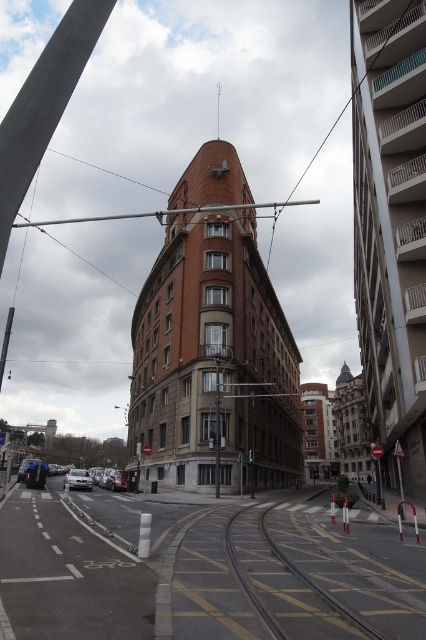
How much distance is there between silver metallic sedan at lower left and silver metallic car at lower left?

silver metallic sedan at lower left is 12.40 meters away from silver metallic car at lower left.

Which is behind, point (75, 470) or point (124, 484)?

The point (75, 470) is behind.

Where is `silver metallic sedan at lower left`? The width and height of the screenshot is (426, 640). silver metallic sedan at lower left is located at coordinates (77, 480).

Can you confirm if yellow textured train track at center is positioned above silver metallic car at lower left?

Yes, yellow textured train track at center is above silver metallic car at lower left.

Which is behind, point (359, 620) or point (112, 468)?

Positioned behind is point (112, 468).

The width and height of the screenshot is (426, 640). Identify the location of yellow textured train track at center. (310, 579).

Is yellow textured train track at center shorter than silver metallic sedan at lower left?

Correct, yellow textured train track at center is not as tall as silver metallic sedan at lower left.

Does yellow textured train track at center have a lesser width compared to silver metallic sedan at lower left?

Yes, yellow textured train track at center is thinner than silver metallic sedan at lower left.

Between point (275, 625) and point (66, 486), which one is positioned behind?

Point (66, 486)

You are a GUI agent. You are given a task and a screenshot of the screen. Output one action in this format:
    pyautogui.click(x=<x>, y=<y>)
    Task: Click on the yellow textured train track at center
    
    Given the screenshot: What is the action you would take?
    pyautogui.click(x=310, y=579)